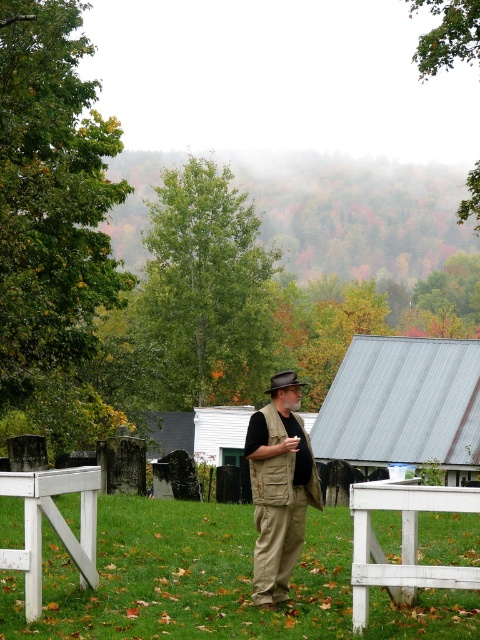
Question: Which object is positioned closest to the white wooden picnic table at lower right?

Choices:
 (A) brown felt cowboy hat at center
 (B) white painted wood picnic table at lower left
 (C) khaki cotton pants at center

Answer: (C)

Question: Which object is farther from the camera taking this photo?

Choices:
 (A) white wooden picnic table at lower right
 (B) metallic gray hut at center-right
 (C) white painted wood picnic table at lower left

Answer: (B)

Question: Is metallic gray hut at center-right smaller than brown felt cowboy hat at center?

Choices:
 (A) yes
 (B) no

Answer: (B)

Question: Is white wooden picnic table at lower right above white painted wood picnic table at lower left?

Choices:
 (A) yes
 (B) no

Answer: (B)

Question: Can you confirm if metallic gray hut at center-right is wider than white wooden picnic table at lower right?

Choices:
 (A) yes
 (B) no

Answer: (A)

Question: Which of the following is the farthest from the observer?

Choices:
 (A) (300, 381)
 (B) (354, 362)
 (C) (430, 586)
 (D) (95, 552)

Answer: (B)